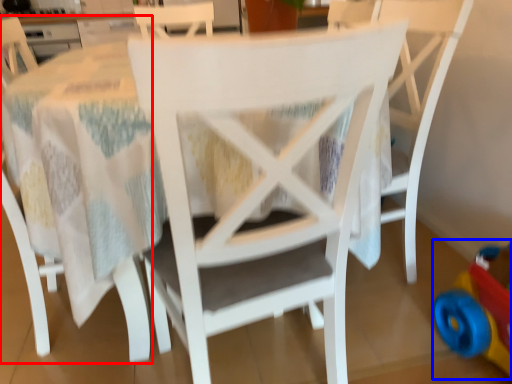
Question: Which point is further to the camera, chair (highlighted by a red box) or toy (highlighted by a blue box)?

Choices:
 (A) chair
 (B) toy

Answer: (B)